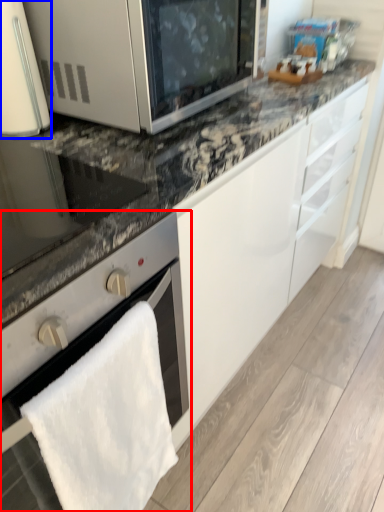
Question: Which object appears farthest to the camera in this image, oven (highlighted by a red box) or home appliance (highlighted by a blue box)?

Choices:
 (A) oven
 (B) home appliance

Answer: (B)